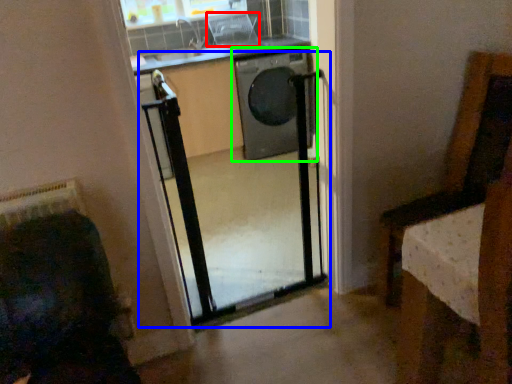
Question: Which is nearer to the armchair (highlighted by a red box)? screen door (highlighted by a blue box) or washing machine (highlighted by a green box).

Choices:
 (A) screen door
 (B) washing machine

Answer: (B)